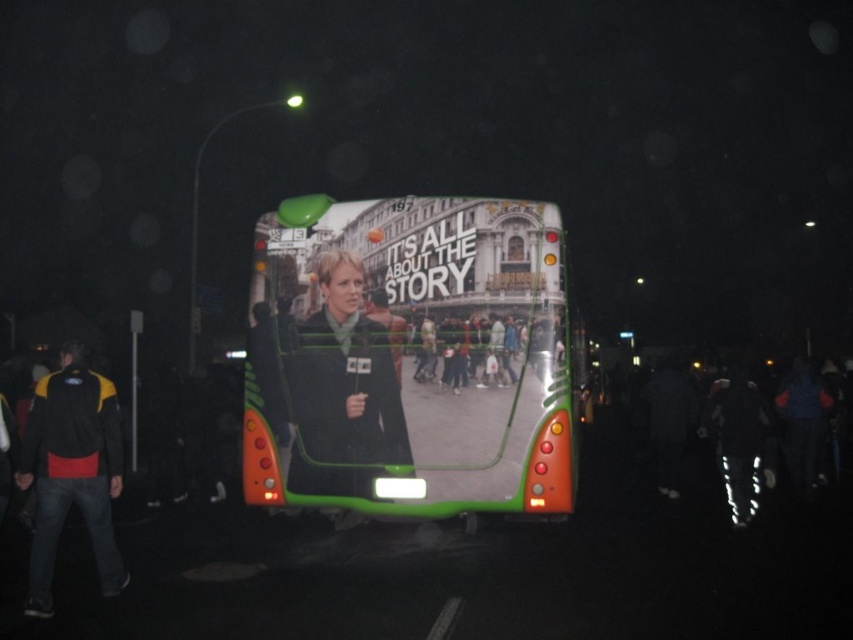
Question: Which object appears closest to the camera in this image?

Choices:
 (A) green matte bus at center
 (B) matte black jacket at center

Answer: (A)

Question: Among these points, which one is farthest from the camera?

Choices:
 (A) (119, 436)
 (B) (376, 372)
 (C) (491, 316)

Answer: (B)

Question: Which of the following is the farthest from the observer?

Choices:
 (A) (61, 524)
 (B) (343, 394)
 (C) (279, 492)

Answer: (B)

Question: Does matte black jacket at center have a lesser width compared to black/yellow jacket at left?

Choices:
 (A) yes
 (B) no

Answer: (B)

Question: Can you confirm if matte black jacket at center is bigger than black/yellow jacket at left?

Choices:
 (A) yes
 (B) no

Answer: (B)

Question: Can you confirm if green matte bus at center is positioned above matte black jacket at center?

Choices:
 (A) no
 (B) yes

Answer: (B)